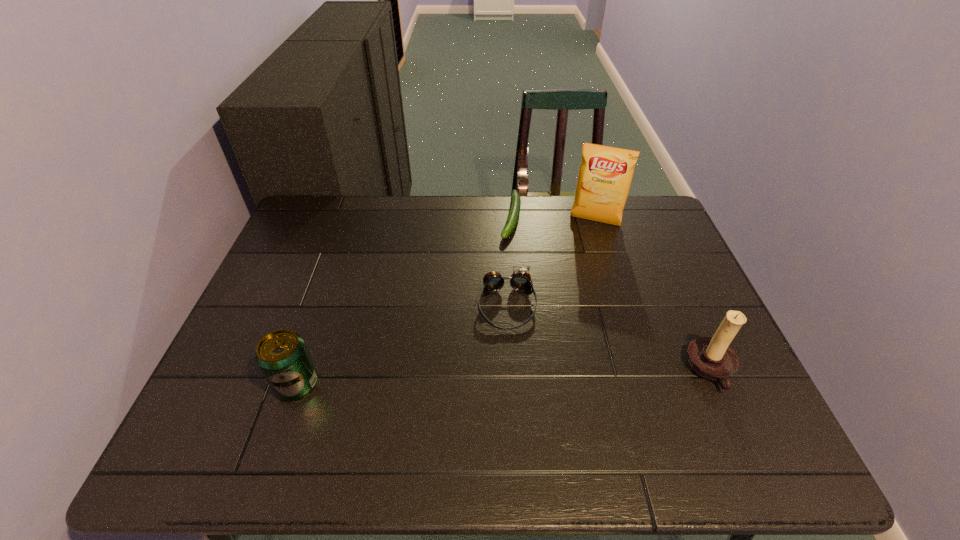
Identify the location of object that is positioned at the far right corner. (605, 175).

At what (x,y) coordinates should I click in order to perform the action: click on object that is at the near right corner. Please return your answer as a coordinate pair (x, y). The width and height of the screenshot is (960, 540). Looking at the image, I should click on (710, 357).

The height and width of the screenshot is (540, 960). In the image, there is a desktop. What are the coordinates of `blank space at the far edge` in the screenshot? It's located at click(x=566, y=198).

The width and height of the screenshot is (960, 540). In order to click on vacant space at the left edge in this screenshot , I will do `click(288, 253)`.

You are a GUI agent. You are given a task and a screenshot of the screen. Output one action in this format:
    pyautogui.click(x=<x>, y=<y>)
    Task: Click on the vacant area at the right edge
    The image size is (960, 540).
    Given the screenshot: What is the action you would take?
    pyautogui.click(x=670, y=288)

What are the coordinates of `free space at the far left corner of the desktop` in the screenshot? It's located at [311, 199].

This screenshot has height=540, width=960. Find the location of `free spot at the far right corner of the desktop`. free spot at the far right corner of the desktop is located at coordinates (654, 204).

In the image, there is a desktop. Where is `vacant space at the near right corner`? vacant space at the near right corner is located at coordinates (694, 383).

The image size is (960, 540). Identify the location of vacant point located between the zucchini and the beer can. (404, 301).

Identify the location of free area in between the goggles and the crisp (potato chip). (551, 264).